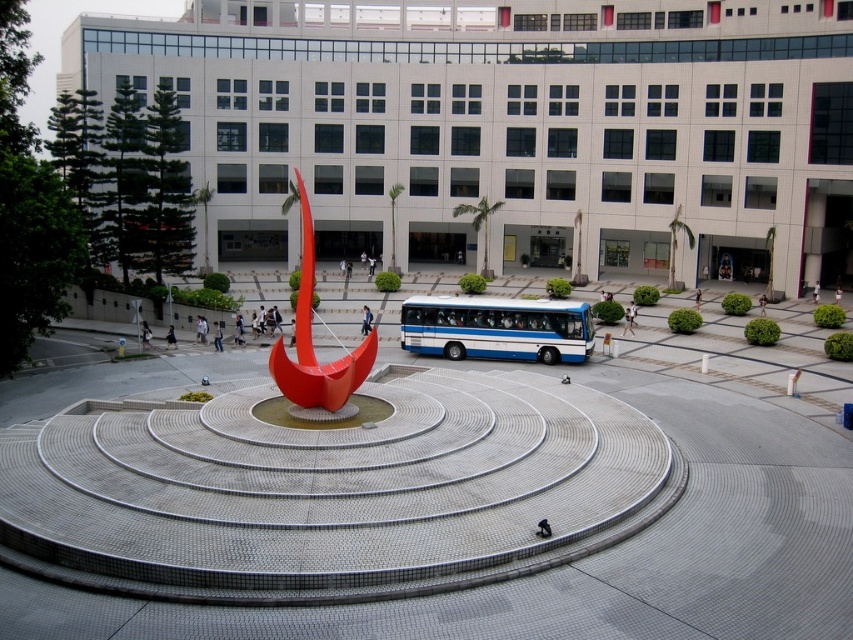
Looking at this image, between blue/white bus at center and glossy red sculpture at center, which one has less height?

blue/white bus at center is shorter.

Is point (479, 342) less distant than point (306, 324)?

No, it is not.

Is point (554, 324) farther from camera compared to point (293, 376)?

Yes, it is.

Find the location of a particular element. Image resolution: width=853 pixels, height=640 pixels. blue/white bus at center is located at coordinates (496, 328).